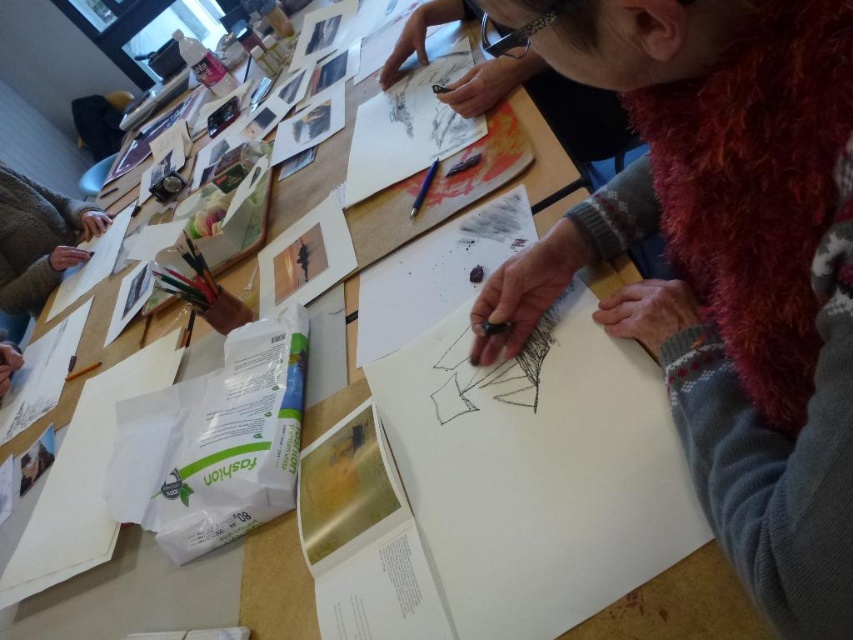
Question: Is white paper at center positioned before blue metallic pencil at center?

Choices:
 (A) no
 (B) yes

Answer: (A)

Question: Is white paper at center above blue metallic pencil at center?

Choices:
 (A) no
 (B) yes

Answer: (B)

Question: Which object is farther from the camera taking this photo?

Choices:
 (A) blue metallic pencil at center
 (B) white paper at center

Answer: (B)

Question: Which point appears farthest from the camera in this image?

Choices:
 (A) (424, 189)
 (B) (460, 58)

Answer: (B)

Question: Does white paper at center appear over blue metallic pencil at center?

Choices:
 (A) no
 (B) yes

Answer: (B)